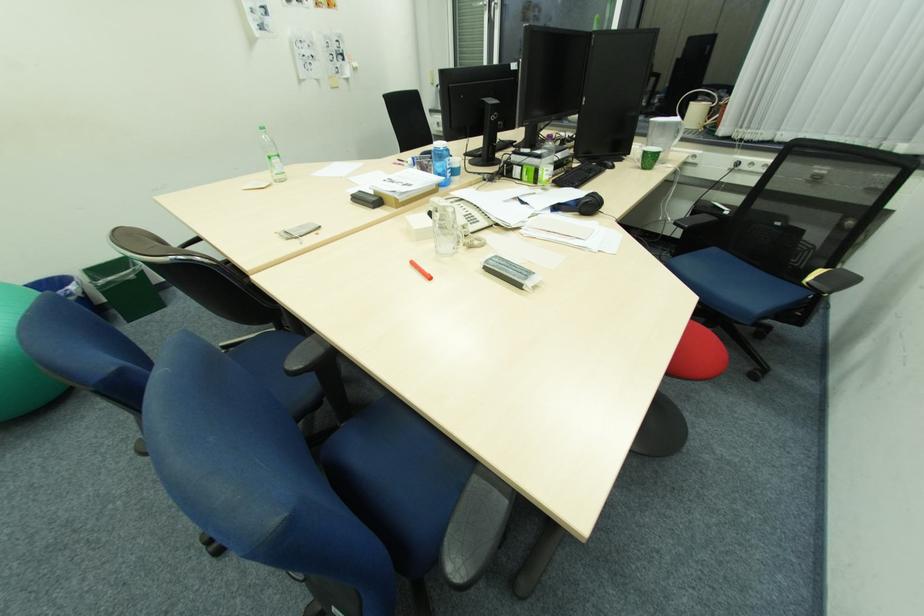
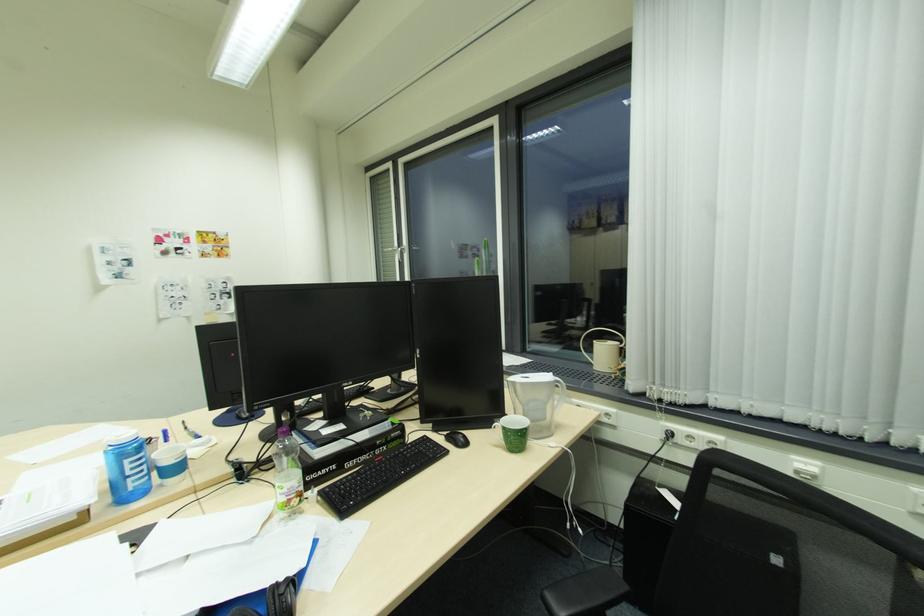
Question: I am providing you with two images of the same scene from different viewpoints. After the viewpoint changes to image2, which objects are now occluded?

Choices:
 (A) silver window handle
 (B) door lever handle
 (C) chair armrest
 (D) glass mug handle

Answer: (D)